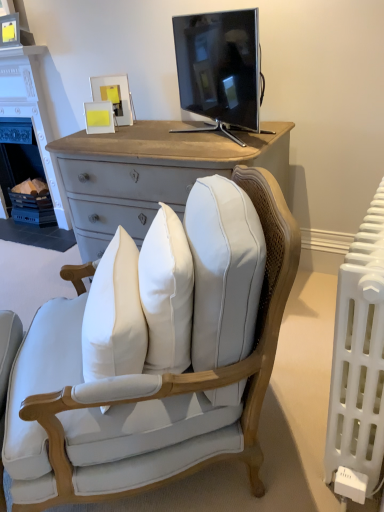
Describe the element at coordinates (220, 68) in the screenshot. This screenshot has width=384, height=512. I see `black glossy tv at upper center` at that location.

Find the location of `black glossy tv at upper center`. black glossy tv at upper center is located at coordinates (220, 68).

Can you confirm if white plastic radiator at right is shorter than white painted wood fireplace at left?

Correct, white plastic radiator at right is not as tall as white painted wood fireplace at left.

Considering the positions of objects white plastic radiator at right and white painted wood fireplace at left in the image provided, who is behind, white plastic radiator at right or white painted wood fireplace at left?

white painted wood fireplace at left is further away from the camera.

Is white plastic radiator at right turned away from white painted wood fireplace at left?

No, white plastic radiator at right's orientation is not away from white painted wood fireplace at left.

From the image's perspective, which is above, white plastic radiator at right or white painted wood fireplace at left?

white painted wood fireplace at left, from the image's perspective.

Between point (189, 91) and point (268, 361), which one is positioned in front?

Positioned in front is point (268, 361).

Is black glossy tv at upper center aimed at light blue fabric chair at center?

No, black glossy tv at upper center is not turned towards light blue fabric chair at center.

I want to click on chair below the black glossy tv at upper center (from a real-world perspective), so 200,372.

Is black glossy tv at upper center in front of or behind light blue fabric chair at center in the image?

Visually, black glossy tv at upper center is located behind light blue fabric chair at center.

From a real-world perspective, is light blue fabric chair at center physically below black glossy tv at upper center?

Indeed, from a real-world perspective, light blue fabric chair at center is positioned beneath black glossy tv at upper center.

Is light blue fabric chair at center facing away from black glossy tv at upper center?

That's not correct — light blue fabric chair at center is not looking away from black glossy tv at upper center.

Is light blue fabric chair at center taller than black glossy tv at upper center?

Correct, light blue fabric chair at center is much taller as black glossy tv at upper center.

Measure the distance from light blue fabric chair at center to white painted wood fireplace at left.

The distance of light blue fabric chair at center from white painted wood fireplace at left is 2.08 meters.

Considering the relative sizes of light blue fabric chair at center and white painted wood fireplace at left in the image provided, is light blue fabric chair at center thinner than white painted wood fireplace at left?

In fact, light blue fabric chair at center might be wider than white painted wood fireplace at left.

From a real-world perspective, who is located higher, light blue fabric chair at center or white painted wood fireplace at left?

white painted wood fireplace at left is physically above.

From the image's perspective, is light blue fabric chair at center above or below white painted wood fireplace at left?

light blue fabric chair at center is situated lower than white painted wood fireplace at left in the image.

Does black glossy tv at upper center have a greater width compared to white painted wood fireplace at left?

Yes, black glossy tv at upper center is wider than white painted wood fireplace at left.

Can we say black glossy tv at upper center lies outside white painted wood fireplace at left?

Indeed, black glossy tv at upper center is completely outside white painted wood fireplace at left.

From the image's perspective, who appears lower, black glossy tv at upper center or white painted wood fireplace at left?

black glossy tv at upper center is shown below in the image.

Is black glossy tv at upper center at the right side of white painted wood fireplace at left?

Indeed, black glossy tv at upper center is positioned on the right side of white painted wood fireplace at left.

Looking at this image, how much distance is there between light blue fabric chair at center and white plastic radiator at right?

light blue fabric chair at center and white plastic radiator at right are 30.42 centimeters apart from each other.

How different are the orientations of light blue fabric chair at center and white plastic radiator at right in degrees?

The angular difference between light blue fabric chair at center and white plastic radiator at right is 34.9 degrees.

Where is `radiator below the light blue fabric chair at center (from a real-world perspective)`? radiator below the light blue fabric chair at center (from a real-world perspective) is located at coordinates click(x=358, y=365).

Is light blue fabric chair at center in contact with white plastic radiator at right?

light blue fabric chair at center is not next to white plastic radiator at right, and they're not touching.

In terms of width, does white painted wood fireplace at left look wider or thinner when compared to white plastic radiator at right?

In the image, white painted wood fireplace at left appears to be wider than white plastic radiator at right.

Is point (24, 67) positioned before point (375, 461)?

No.

Is white painted wood fireplace at left taller or shorter than white plastic radiator at right?

Considering their sizes, white painted wood fireplace at left has more height than white plastic radiator at right.

Is white painted wood fireplace at left bigger than white plastic radiator at right?

Indeed, white painted wood fireplace at left has a larger size compared to white plastic radiator at right.

Identify the location of radiator in front of the white painted wood fireplace at left. (358, 365).

You are a GUI agent. You are given a task and a screenshot of the screen. Output one action in this format:
    pyautogui.click(x=<x>, y=<y>)
    Task: Click on the chair that is on the left side of black glossy tv at upper center
    The image size is (384, 512).
    Given the screenshot: What is the action you would take?
    pyautogui.click(x=200, y=372)

From the image, which object appears to be nearer to white painted wood fireplace at left, light blue fabric chair at center or white plastic radiator at right?

light blue fabric chair at center lies closer to white painted wood fireplace at left than the other object.

Looking at the image, which one is located closer to light blue fabric chair at center, black glossy tv at upper center or white plastic radiator at right?

Among the two, white plastic radiator at right is located nearer to light blue fabric chair at center.

When comparing their distances from black glossy tv at upper center, does white painted wood fireplace at left or light blue fabric chair at center seem closer?

light blue fabric chair at center is positioned closer to the anchor black glossy tv at upper center.

From the image, which object appears to be farther from black glossy tv at upper center, light blue fabric chair at center or white plastic radiator at right?

white plastic radiator at right.

Based on their spatial positions, is white plastic radiator at right or white painted wood fireplace at left closer to light blue fabric chair at center?

white plastic radiator at right lies closer to light blue fabric chair at center than the other object.

Which object lies further to the anchor point white plastic radiator at right, light blue fabric chair at center or white painted wood fireplace at left?

Among the two, white painted wood fireplace at left is located further to white plastic radiator at right.

When comparing their distances from black glossy tv at upper center, does white painted wood fireplace at left or white plastic radiator at right seem closer?

Among the two, white plastic radiator at right is located nearer to black glossy tv at upper center.

Estimate the real-world distances between objects in this image. Which object is further from black glossy tv at upper center, light blue fabric chair at center or white painted wood fireplace at left?

white painted wood fireplace at left.

At what (x,y) coordinates should I click in order to perform the action: click on television located between white painted wood fireplace at left and white plastic radiator at right in the left-right direction. Please return your answer as a coordinate pair (x, y). The width and height of the screenshot is (384, 512). Looking at the image, I should click on (220, 68).

Locate an element on the screen. television located between light blue fabric chair at center and white painted wood fireplace at left in the depth direction is located at coordinates (220, 68).

You are a GUI agent. You are given a task and a screenshot of the screen. Output one action in this format:
    pyautogui.click(x=<x>, y=<y>)
    Task: Click on the radiator between black glossy tv at upper center and light blue fabric chair at center in the vertical direction
    Image resolution: width=384 pixels, height=512 pixels.
    Given the screenshot: What is the action you would take?
    pyautogui.click(x=358, y=365)

Find the location of `radiator positioned between light blue fabric chair at center and white painted wood fireplace at left from near to far`. radiator positioned between light blue fabric chair at center and white painted wood fireplace at left from near to far is located at coordinates (358, 365).